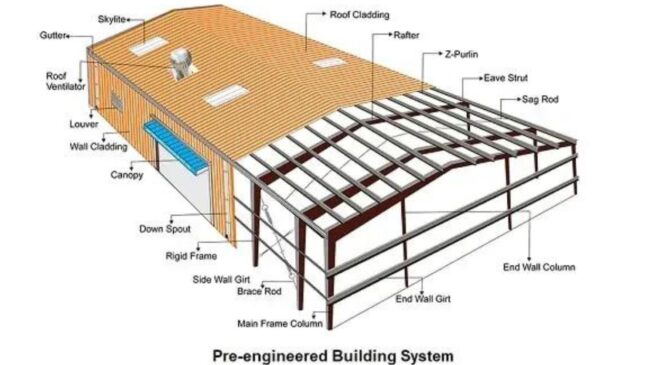
Locate an element on the screen. panel is located at coordinates (379, 226).